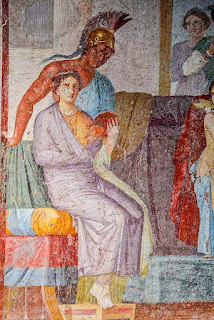
You are a GUI agent. You are given a task and a screenshot of the screen. Output one action in this format:
    pyautogui.click(x=<x>, y=<y>)
    Task: Click on the wall
    The height and width of the screenshot is (320, 214).
    Given the screenshot: What is the action you would take?
    pyautogui.click(x=30, y=67)